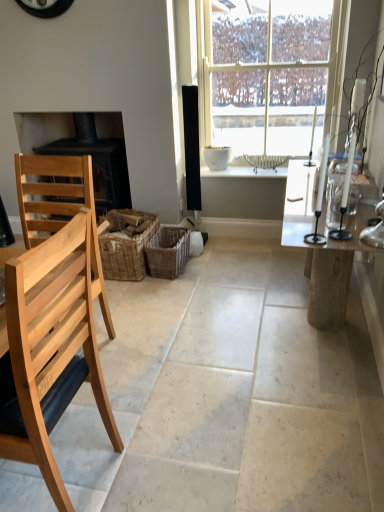
Find the location of `vacant region to the right of woven brown basket at center, the 1th crate positioned from the right`. vacant region to the right of woven brown basket at center, the 1th crate positioned from the right is located at coordinates (209, 269).